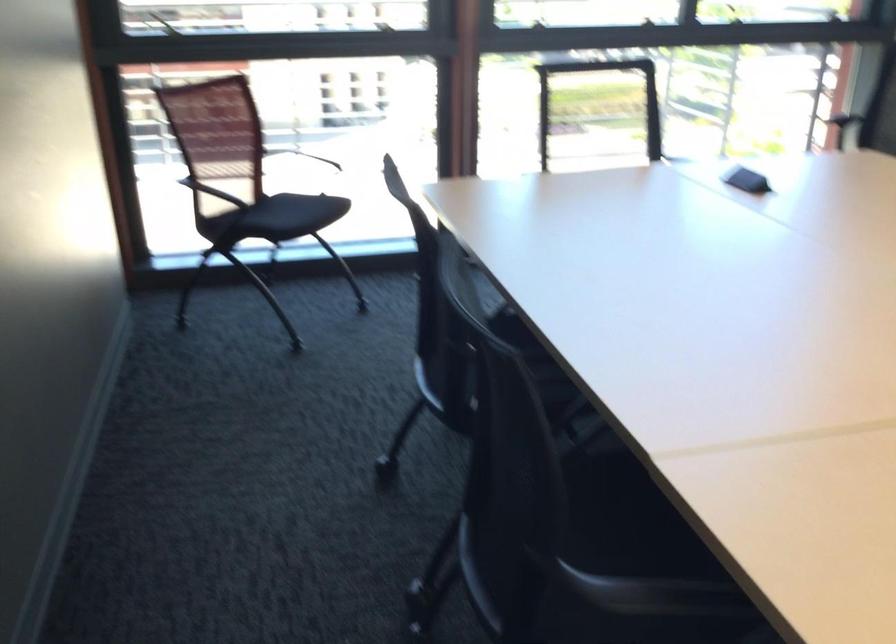
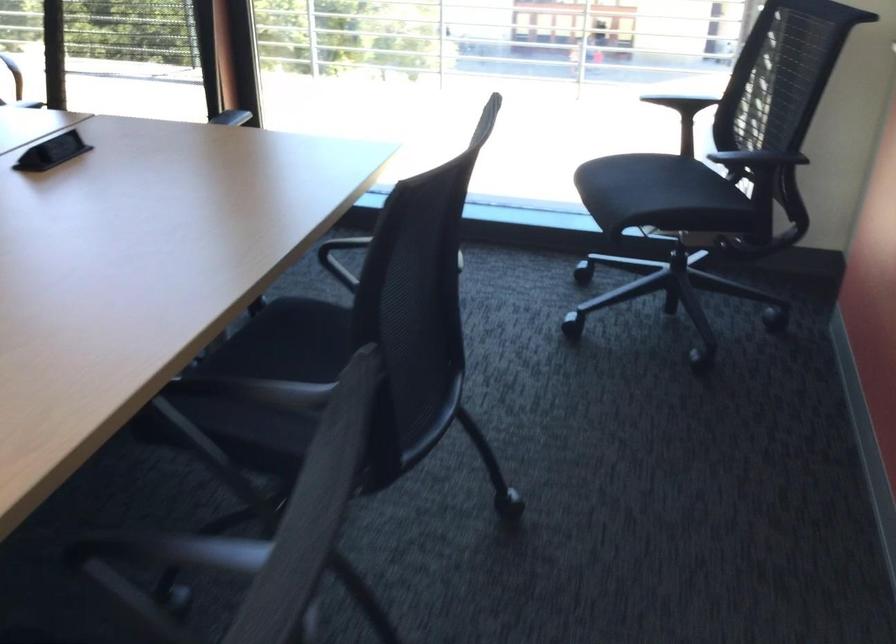
The images are taken continuously from a first-person perspective. In which direction are you moving?

The cameraman moved toward right, forward.